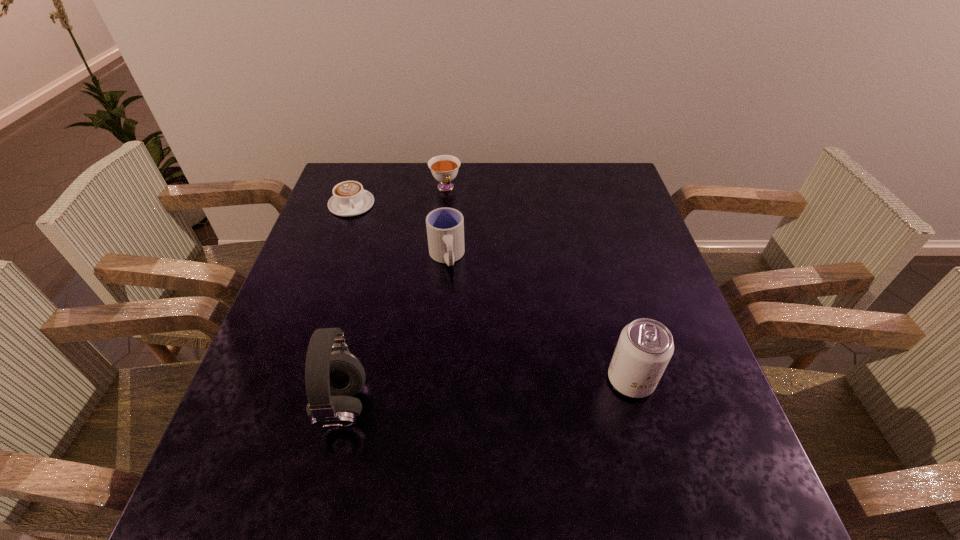
At what (x,y) coordinates should I click in order to perform the action: click on vacant space on the desktop that is between the tallest object and the second tallest object and is positioned with the handle on the side of the third tallest object. Please return your answer as a coordinate pair (x, y). Looking at the image, I should click on (464, 395).

Locate an element on the screen. vacant space on the desktop that is between the second object from left to right and the rightmost object and is positioned on the side of the teacup with the handle is located at coordinates (517, 390).

Find the location of a particular element. free spot on the desktop that is between the headset and the soda can and is positioned with the handle on the right side of the cappuccino is located at coordinates (454, 396).